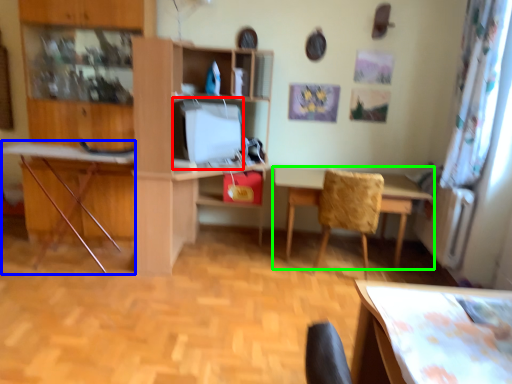
Question: Which object is the closest to the computer monitor (highlighted by a red box)? Choose among these: computer desk (highlighted by a blue box) or table (highlighted by a green box).

Choices:
 (A) computer desk
 (B) table

Answer: (A)